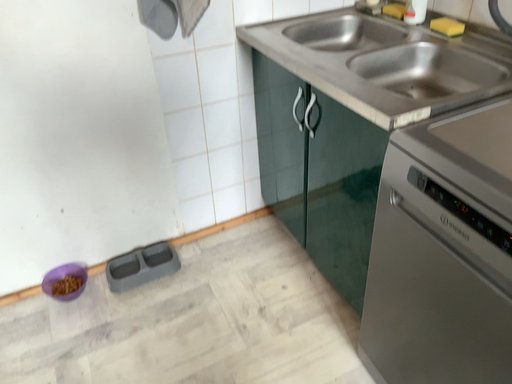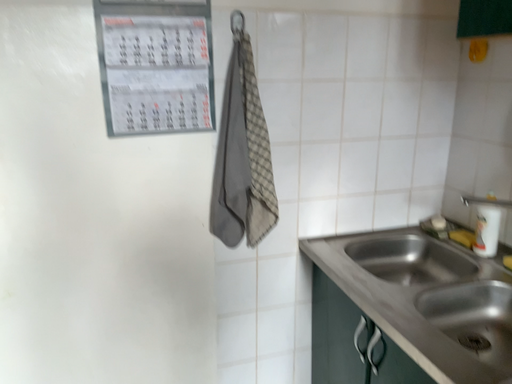
Question: Which way did the camera rotate in the video?

Choices:
 (A) rotated upward
 (B) rotated downward

Answer: (A)